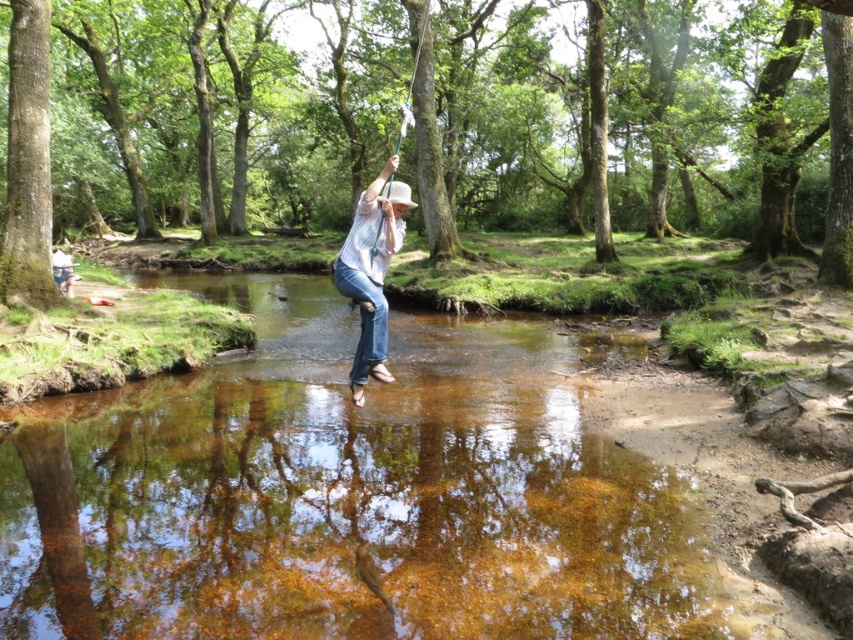
What do you see at coordinates (422, 124) in the screenshot? I see `green smooth bark tree at center` at bounding box center [422, 124].

Between green smooth bark tree at center and white cotton shirt at center, which one has less height?

white cotton shirt at center

I want to click on green smooth bark tree at center, so click(422, 124).

I want to click on green smooth bark tree at center, so click(422, 124).

Between green rough bark tree at left and white cotton shirt at center, which one is positioned lower?

white cotton shirt at center is lower down.

Describe the element at coordinates (28, 161) in the screenshot. I see `green rough bark tree at left` at that location.

Locate an element on the screen. green rough bark tree at left is located at coordinates click(x=28, y=161).

Is green smooth bark tree at center above green rough bark tree at left?

Indeed, green smooth bark tree at center is positioned over green rough bark tree at left.

Does point (509, 92) come in front of point (10, 68)?

No, (509, 92) is behind (10, 68).

Locate an element on the screen. green smooth bark tree at center is located at coordinates (422, 124).